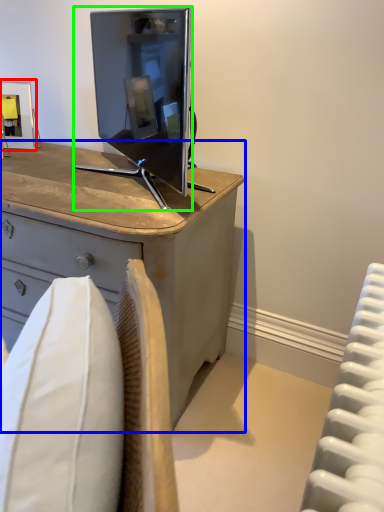
Question: Which is farther away from picture frame (highlighted by a red box)? desk (highlighted by a blue box) or television (highlighted by a green box)?

Choices:
 (A) desk
 (B) television

Answer: (A)